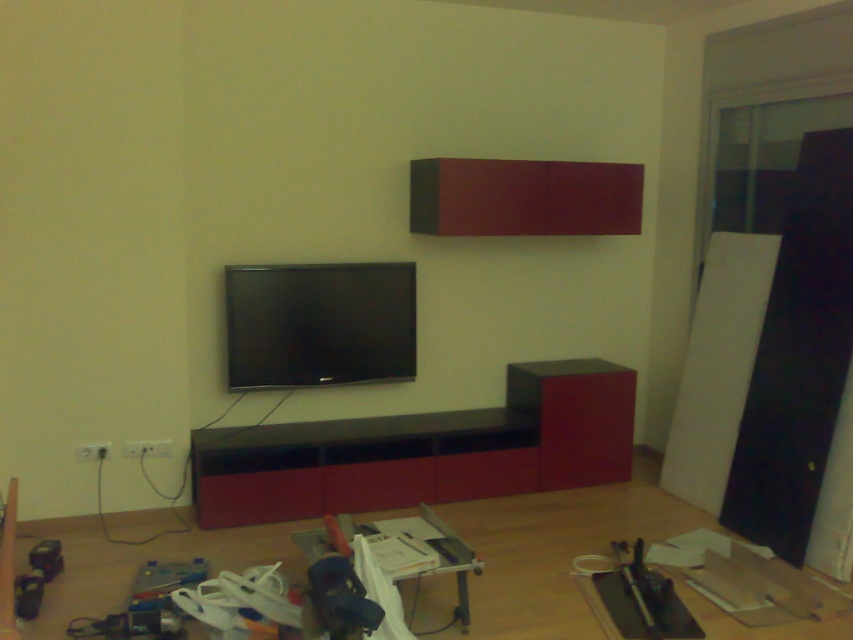
The image size is (853, 640). What do you see at coordinates (422, 451) in the screenshot?
I see `matte black entertainment center at center` at bounding box center [422, 451].

Between point (207, 486) and point (370, 272), which one is positioned in front?

Point (207, 486)

Who is more distant from viewer, [207,445] or [312,376]?

The point [312,376] is more distant.

Identify the location of matte black entertainment center at center. (x=422, y=451).